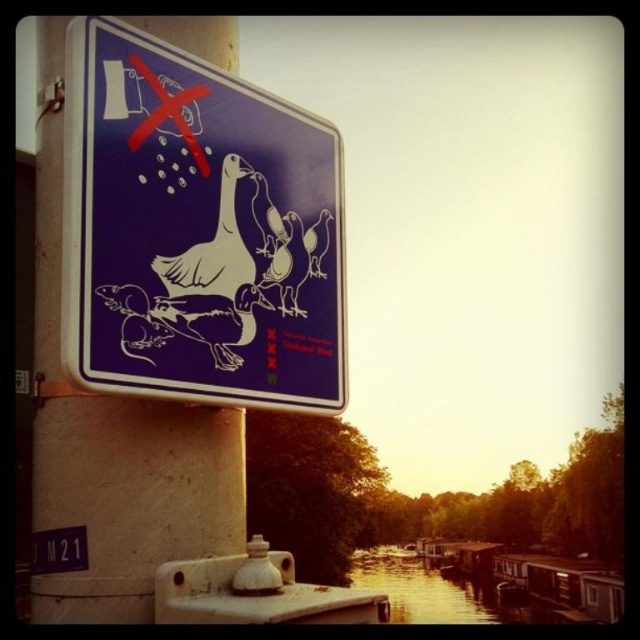
Question: Is matte blue sign at upper left bigger than metallic pole at left?

Choices:
 (A) yes
 (B) no

Answer: (B)

Question: Which point is closer to the camera?

Choices:
 (A) (342, 348)
 (B) (67, 582)
 (C) (36, 561)

Answer: (B)

Question: Which of the following is the closest to the observer?

Choices:
 (A) blue plastic sign at upper left
 (B) matte blue sign at upper left

Answer: (B)

Question: Which object is the farthest from the blue plastic sign at upper left?

Choices:
 (A) metallic pole at left
 (B) matte blue sign at upper left

Answer: (B)

Question: Does matte blue sign at upper left lie in front of metallic pole at left?

Choices:
 (A) yes
 (B) no

Answer: (A)

Question: Considering the relative positions of matte blue sign at upper left and metallic pole at left in the image provided, where is matte blue sign at upper left located with respect to metallic pole at left?

Choices:
 (A) right
 (B) left

Answer: (A)